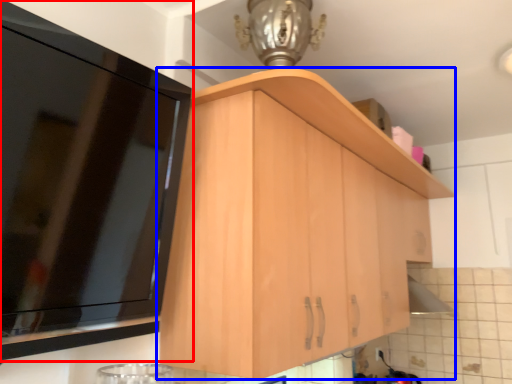
Question: Which object is closer to the camera taking this photo, cabinetry (highlighted by a red box) or cabinetry (highlighted by a blue box)?

Choices:
 (A) cabinetry
 (B) cabinetry

Answer: (A)